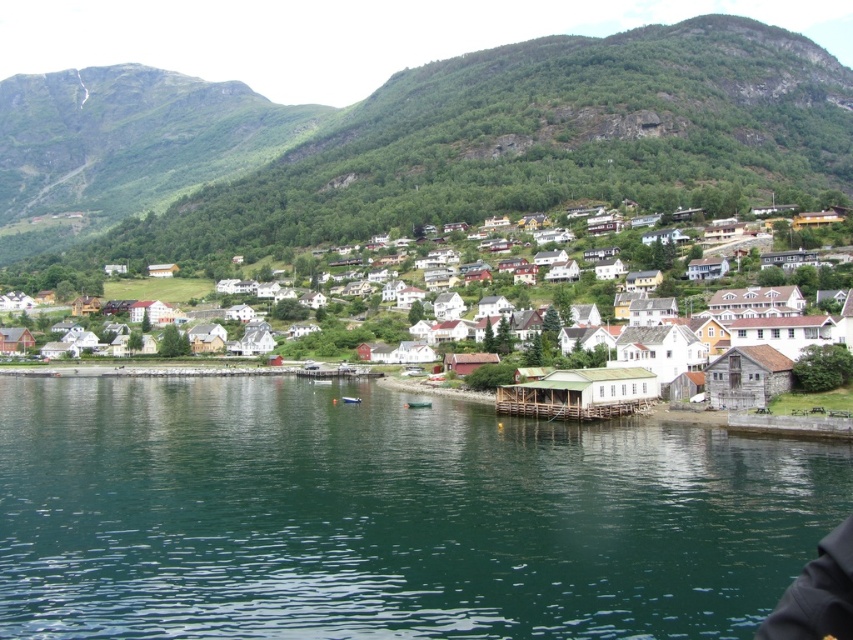
Question: Which is nearer to the green water at lower center?

Choices:
 (A) green grassy hillside at upper center
 (B) white wooden houses at lower right

Answer: (B)

Question: Can you confirm if green grassy hillside at upper center is smaller than white wooden houses at lower right?

Choices:
 (A) yes
 (B) no

Answer: (B)

Question: Which object appears closest to the camera in this image?

Choices:
 (A) green water at lower center
 (B) white wooden houses at lower right
 (C) green grassy hillside at upper center

Answer: (A)

Question: Which object is farther from the camera taking this photo?

Choices:
 (A) green grassy hillside at upper center
 (B) white wooden houses at lower right

Answer: (A)

Question: Does green grassy hillside at upper center appear on the left side of white wooden houses at lower right?

Choices:
 (A) yes
 (B) no

Answer: (A)

Question: Observing the image, what is the correct spatial positioning of green grassy hillside at upper center in reference to white wooden houses at lower right?

Choices:
 (A) below
 (B) above

Answer: (B)